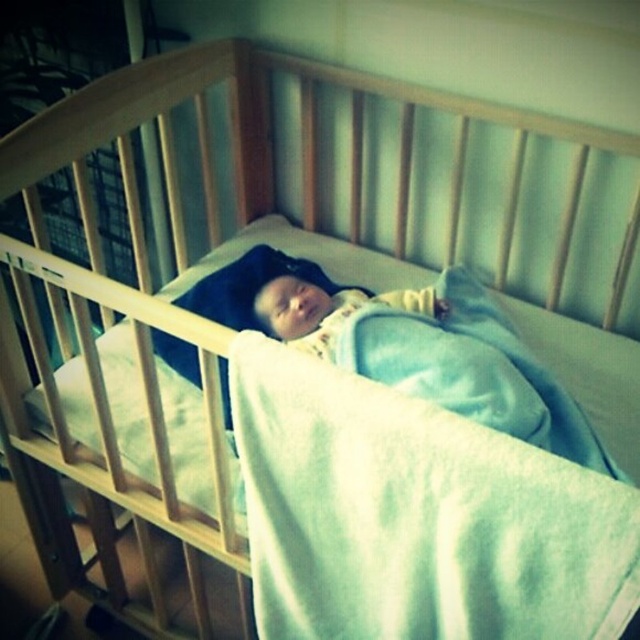
You are a parent checking on your baby in the crib. You see the light blue soft blanket at center and the soft yellow fabric at center. Which one is taller?

The light blue soft blanket at center has a greater height compared to the soft yellow fabric at center, so the light blue soft blanket at center is taller.

In the scene shown: You are a parent checking on your baby in the crib. You notice the light blue soft blanket at center and the soft yellow fabric at center. Which one is wider?

The light blue soft blanket at center is wider than the soft yellow fabric at center.

You are a parent checking on your baby in the crib. You notice the light blue soft blanket at center and the soft yellow fabric at center. Which one is closer to the baby?

The light blue soft blanket at center is closer to the baby because it is in front of the soft yellow fabric at center.